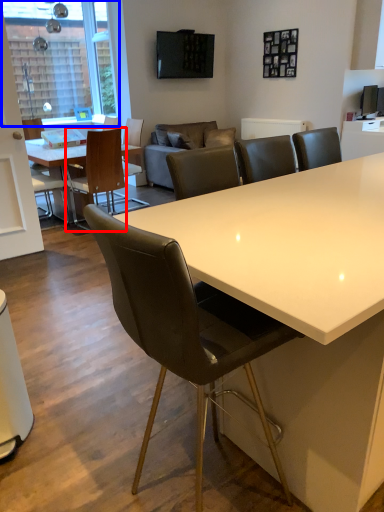
Question: Which point is further to the camera, chair (highlighted by a red box) or window screen (highlighted by a blue box)?

Choices:
 (A) chair
 (B) window screen

Answer: (B)